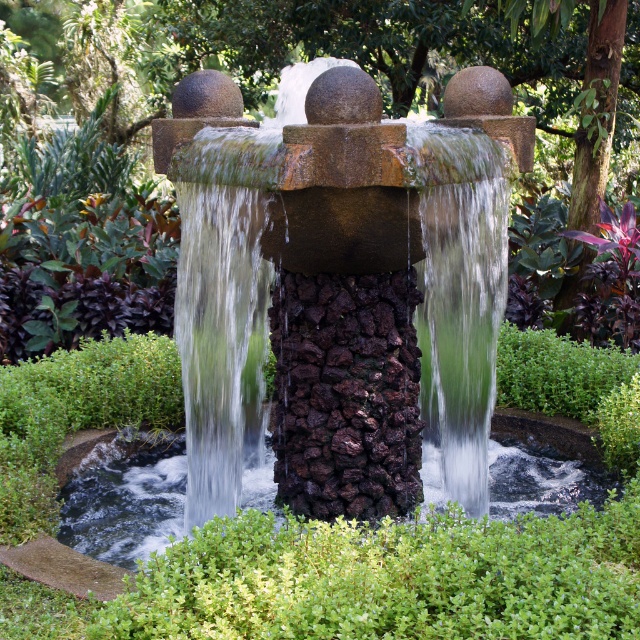
Looking at this image, can you confirm if smooth stone fountain at center is positioned below clear water at center?

No, smooth stone fountain at center is not below clear water at center.

Measure the distance between point (460, 474) and camera.

A distance of 6.11 meters exists between point (460, 474) and camera.

Is point (205, 372) more distant than point (113, 531)?

Yes, point (205, 372) is behind point (113, 531).

This screenshot has width=640, height=640. In order to click on smooth stone fountain at center in this screenshot , I will do `click(346, 285)`.

Does green mossy rock at center appear over clear water at center?

Correct, green mossy rock at center is located above clear water at center.

I want to click on green mossy rock at center, so click(x=460, y=307).

Based on the photo, is smooth stone fountain at center taller than green mossy rock at center?

Indeed, smooth stone fountain at center has a greater height compared to green mossy rock at center.

Can you confirm if smooth stone fountain at center is bigger than green mossy rock at center?

Correct, smooth stone fountain at center is larger in size than green mossy rock at center.

Identify the location of smooth stone fountain at center. The height and width of the screenshot is (640, 640). (346, 285).

At what (x,y) coordinates should I click in order to perform the action: click on smooth stone fountain at center. Please return your answer as a coordinate pair (x, y). This screenshot has height=640, width=640. Looking at the image, I should click on (346, 285).